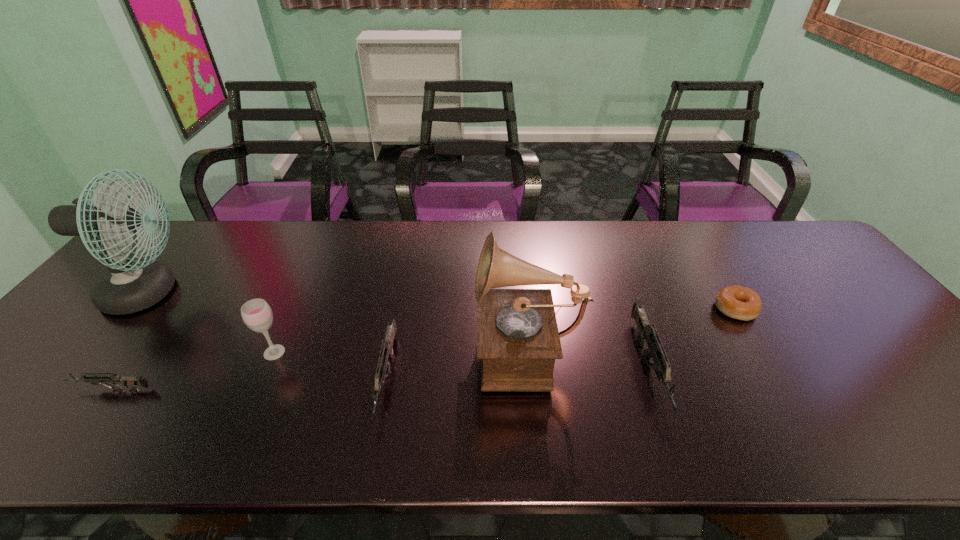
Please point a spot on the right to add another gun. Please provide its 2D coordinates. Your answer should be formatted as a tuple, i.e. [(x, y)], where the tuple contains the x and y coordinates of a point satisfying the conditions above.

[(901, 359)]